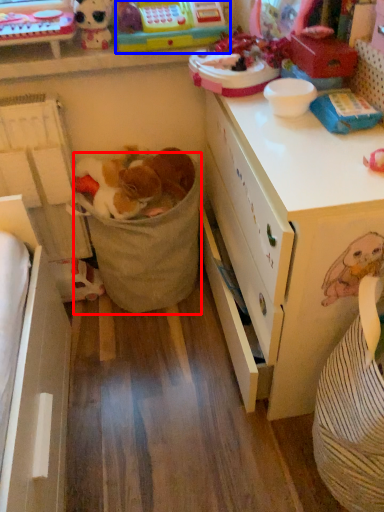
Question: Which object is further to the camera taking this photo, laundry basket (highlighted by a red box) or toy (highlighted by a blue box)?

Choices:
 (A) laundry basket
 (B) toy

Answer: (A)